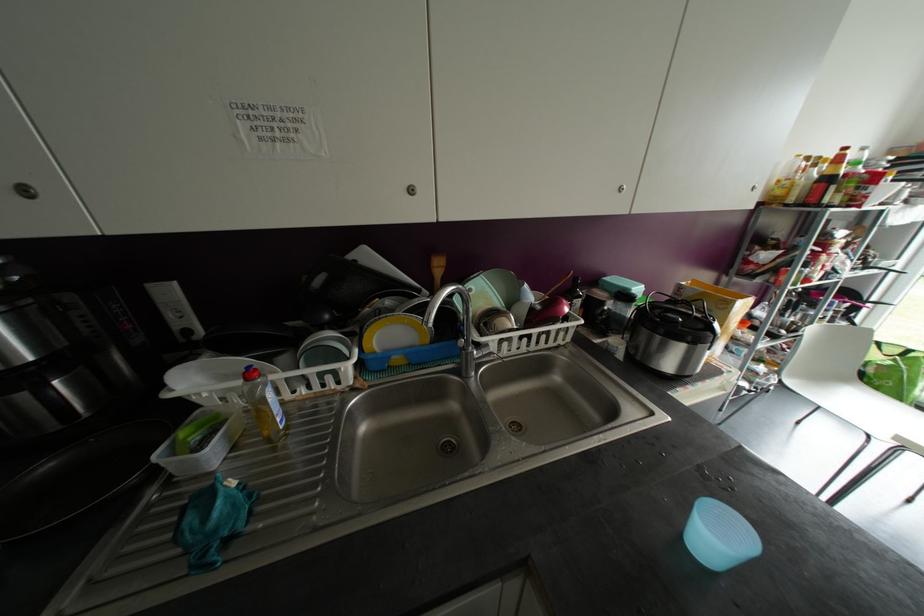
Find the location of `red-capped bottle`. red-capped bottle is located at coordinates (263, 405).